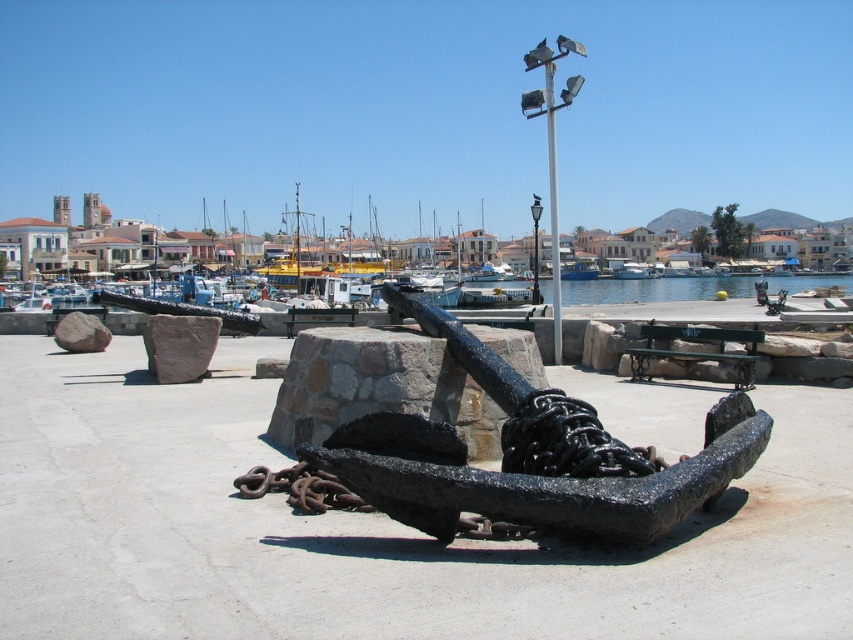
Does brown rough stone at center have a greater height compared to metallic pole at upper center?

No.

Who is more distant from viewer, (178, 368) or (556, 58)?

The point (556, 58) is more distant.

Where is `brown rough stone at center`? Image resolution: width=853 pixels, height=640 pixels. brown rough stone at center is located at coordinates (178, 346).

What do you see at coordinates (697, 349) in the screenshot? The width and height of the screenshot is (853, 640). I see `black metal bench at center` at bounding box center [697, 349].

Is black metal bench at center positioned at the back of metallic pole at upper center?

No, black metal bench at center is closer to the viewer.

I want to click on black metal bench at center, so click(697, 349).

Who is taller, black metal bench at center or blue glossy boat at center?

blue glossy boat at center

Image resolution: width=853 pixels, height=640 pixels. Describe the element at coordinates (697, 349) in the screenshot. I see `black metal bench at center` at that location.

This screenshot has width=853, height=640. What do you see at coordinates (697, 349) in the screenshot?
I see `black metal bench at center` at bounding box center [697, 349].

You are a GUI agent. You are given a task and a screenshot of the screen. Output one action in this format:
    pyautogui.click(x=<x>, y=<y>)
    Task: Click on the black metal bench at center
    The height and width of the screenshot is (640, 853).
    Given the screenshot: What is the action you would take?
    pyautogui.click(x=697, y=349)